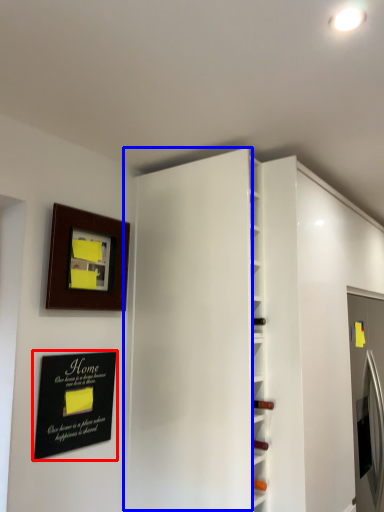
Question: Among these objects, which one is nearest to the camera, plaque (highlighted by a red box) or door (highlighted by a blue box)?

Choices:
 (A) plaque
 (B) door

Answer: (B)